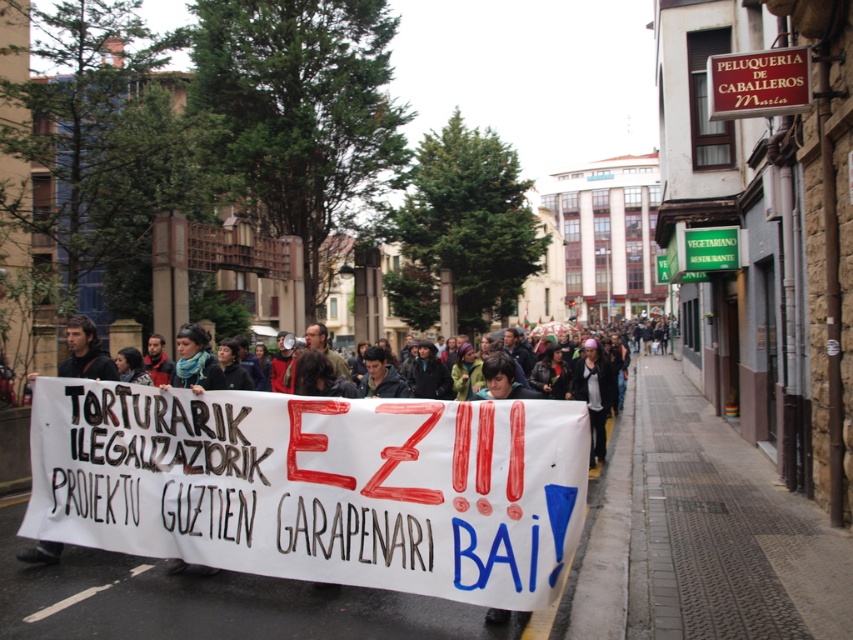
Looking at this image, you are a photographer standing in the middle of the protest area. You want to take a photo of the red wood sign at upper right and the dark brown leather jacket at center. Which object should you focus on first to ensure both are in the same frame?

You should focus on the dark brown leather jacket at center first because it is closer to you than the red wood sign at upper right, which is further away. By focusing on the closer object, the depth of field may still capture the red wood sign at upper right in the background.

You are a photographer trying to capture a clear shot of the white paper banner at center and the matte black jacket at center. If the banner is wider than the jacket, will you need to adjust your camera angle to include both in the frame?

The white paper banner at center might be wider than matte black jacket at center, so you may need to adjust your camera angle to ensure both fit in the frame.

Looking at this image, you are a photographer standing at the edge of the protest. You want to capture a photo of the white paper banner at center and the matte black jacket at center in the same frame. Given that your camera has a maximum focus range of 5 meters, will both objects be in focus?

The distance between the white paper banner at center and the matte black jacket at center is 5.86 meters. Since the camera can only focus within 5 meters, the two objects are too far apart for both to be in focus simultaneously.